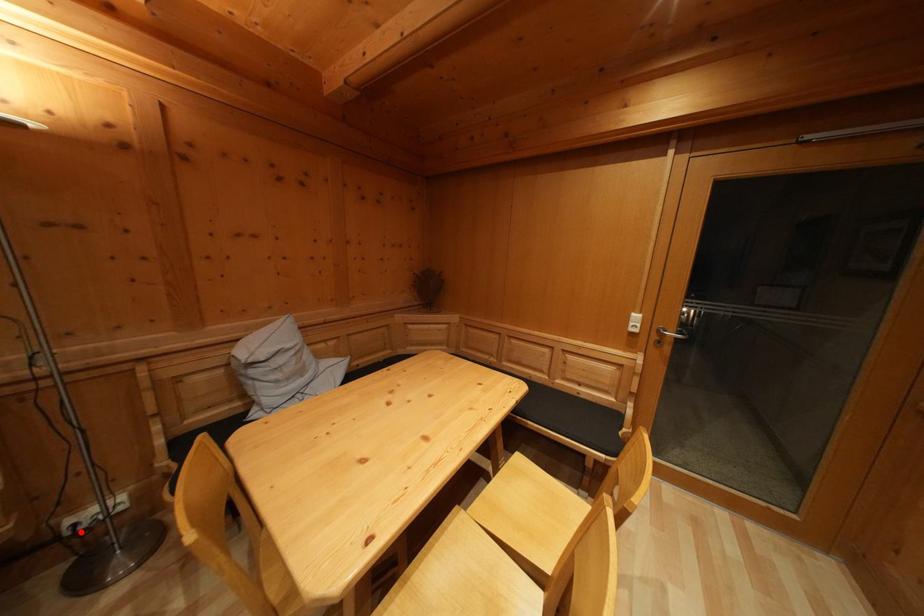
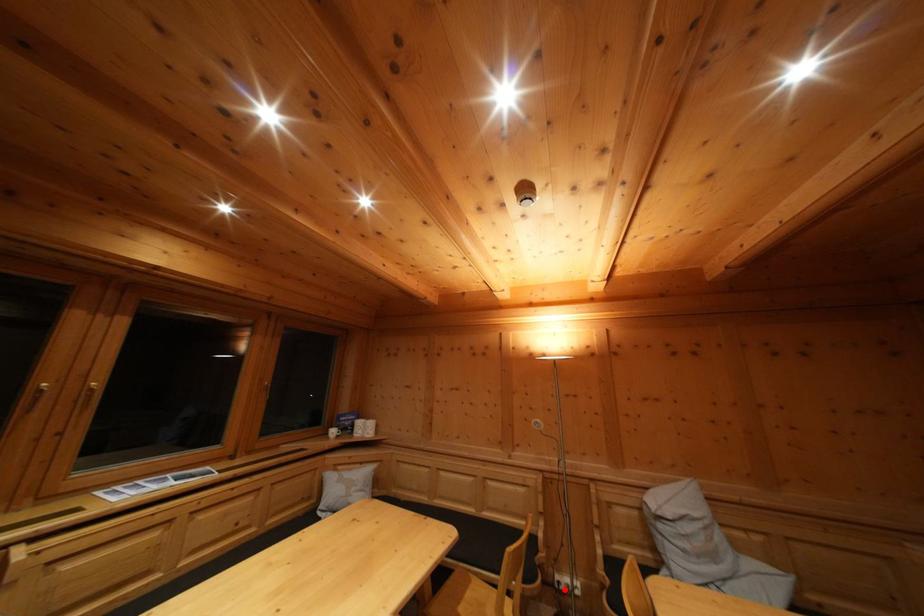
I am providing you with two images of the same scene from different viewpoints. A red point is marked on the first image and another point is marked on the second image. Is the red point in image1 aligned with the point shown in image2?

Yes